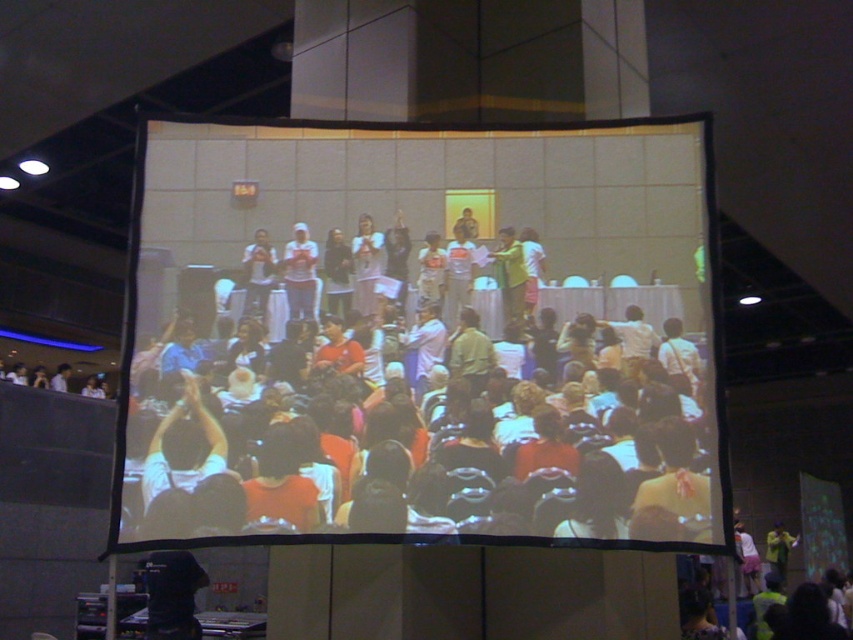
Is matte white screen at center above matte black shirt at center?

Incorrect, matte white screen at center is not positioned above matte black shirt at center.

Describe the element at coordinates (419, 346) in the screenshot. I see `matte white screen at center` at that location.

Locate an element on the screen. Image resolution: width=853 pixels, height=640 pixels. matte white screen at center is located at coordinates (419, 346).

Does white matte shirt at center appear on the left side of white glossy shirt at center?

Correct, you'll find white matte shirt at center to the left of white glossy shirt at center.

Is white matte shirt at center above white glossy shirt at center?

Actually, white matte shirt at center is below white glossy shirt at center.

Is point (297, 227) more distant than point (361, 296)?

Yes.

Image resolution: width=853 pixels, height=640 pixels. I want to click on white matte shirt at center, so click(x=300, y=273).

Can you confirm if white matte shirt at center is positioned below yellow fabric shirt at center?

Actually, white matte shirt at center is above yellow fabric shirt at center.

Is white matte shirt at center wider than yellow fabric shirt at center?

No, white matte shirt at center is not wider than yellow fabric shirt at center.

In order to click on white matte shirt at center in this screenshot , I will do `click(300, 273)`.